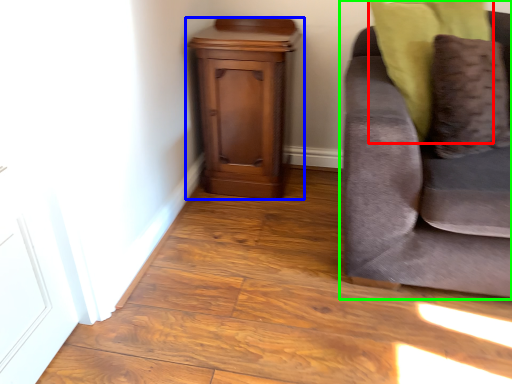
Question: Estimate the real-world distances between objects in this image. Which object is farther from pillow (highlighted by a red box), nightstand (highlighted by a blue box) or studio couch (highlighted by a green box)?

Choices:
 (A) nightstand
 (B) studio couch

Answer: (A)